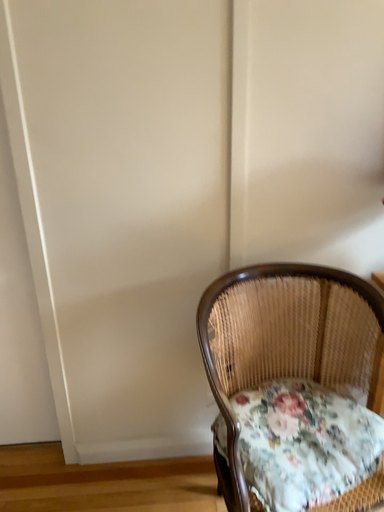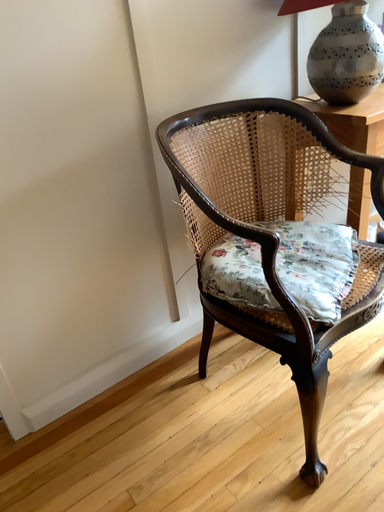
Question: How did the camera likely rotate when shooting the video?

Choices:
 (A) rotated left
 (B) rotated right

Answer: (B)